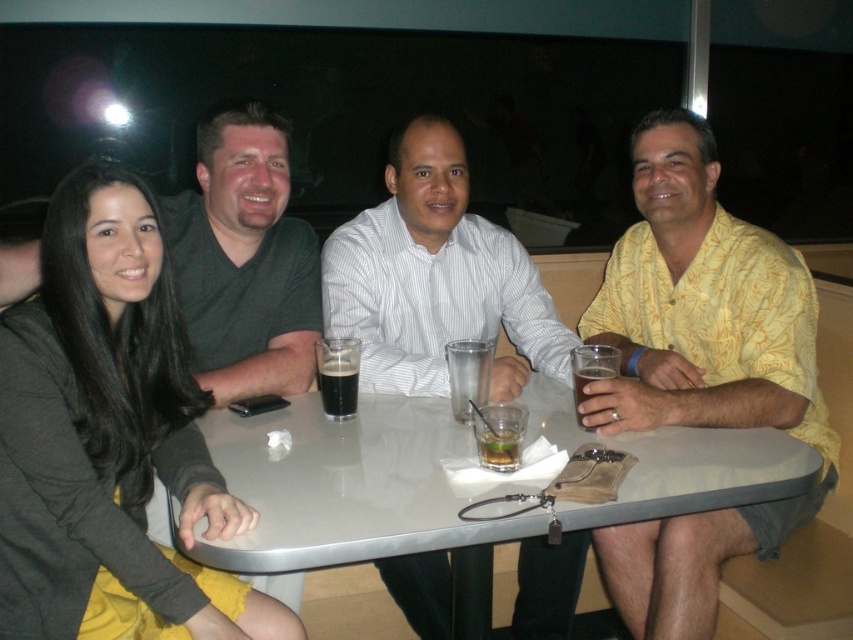
Does matte black jacket at left come behind yellow printed shirt at right?

No, it is in front of yellow printed shirt at right.

Is point (47, 465) behind point (614, 316)?

That is False.

Identify the location of matte black jacket at left. (109, 438).

Who is more forward, (627, 582) or (573, 435)?

Point (573, 435) is more forward.

Measure the distance between point (674,624) and camera.

Point (674,624) and camera are 4.99 feet apart from each other.

Where is `yellow printed shirt at right`? This screenshot has height=640, width=853. yellow printed shirt at right is located at coordinates (699, 369).

Measure the distance between white glossy table at center and camera.

A distance of 3.72 feet exists between white glossy table at center and camera.

Locate an element on the screen. The width and height of the screenshot is (853, 640). white glossy table at center is located at coordinates (347, 484).

Where is `white glossy table at center`? The width and height of the screenshot is (853, 640). white glossy table at center is located at coordinates (347, 484).